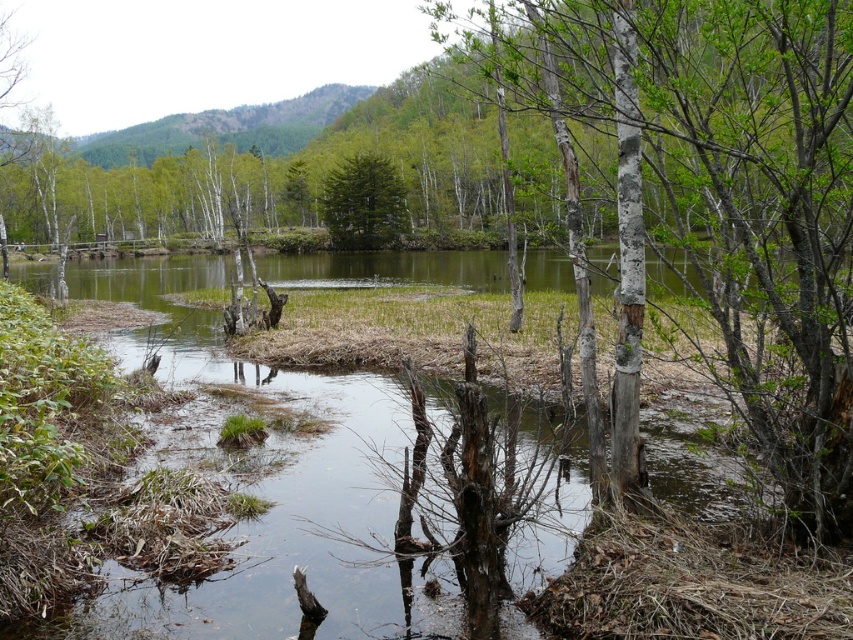
Can you confirm if smooth bark tree at center is positioned to the left of green matte tree at center?

In fact, smooth bark tree at center is to the right of green matte tree at center.

The width and height of the screenshot is (853, 640). What do you see at coordinates (732, 198) in the screenshot?
I see `smooth bark tree at center` at bounding box center [732, 198].

Locate an element on the screen. This screenshot has width=853, height=640. smooth bark tree at center is located at coordinates (732, 198).